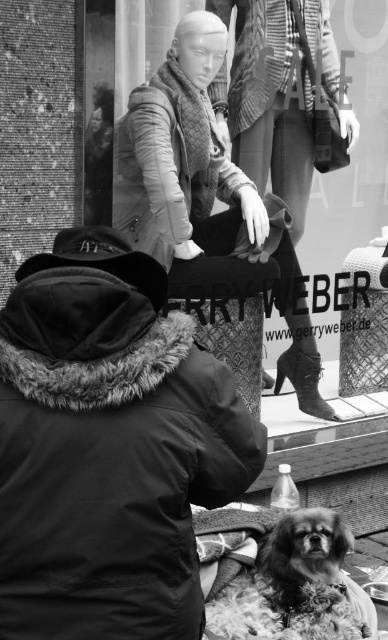
You are a photographer trying to capture the fluffy fur dog at lower center in your shot. The matte beige coat at center is blocking your view. Can you move the coat to get a clear shot of the dog?

The matte beige coat at center is positioned over the fluffy fur dog at lower center, so moving the coat would allow you to see the dog clearly.

You are a customer looking at the window display of the store named Gerry Weber. You see a point at coordinates (183,157). What item is located at that point?

The point at coordinates (183,157) corresponds to the matte beige coat at center.

You are standing in the street scene shown in the image and want to find the matte beige coat at center. Based on the coordinates provided in the Objects Description, can you determine if the coat is closer to the foreground or the background?

The matte beige coat at center is located at point 0.248 on the vertical axis. Since lower values on the vertical axis indicate closer proximity to the foreground, the coat is closer to the foreground.